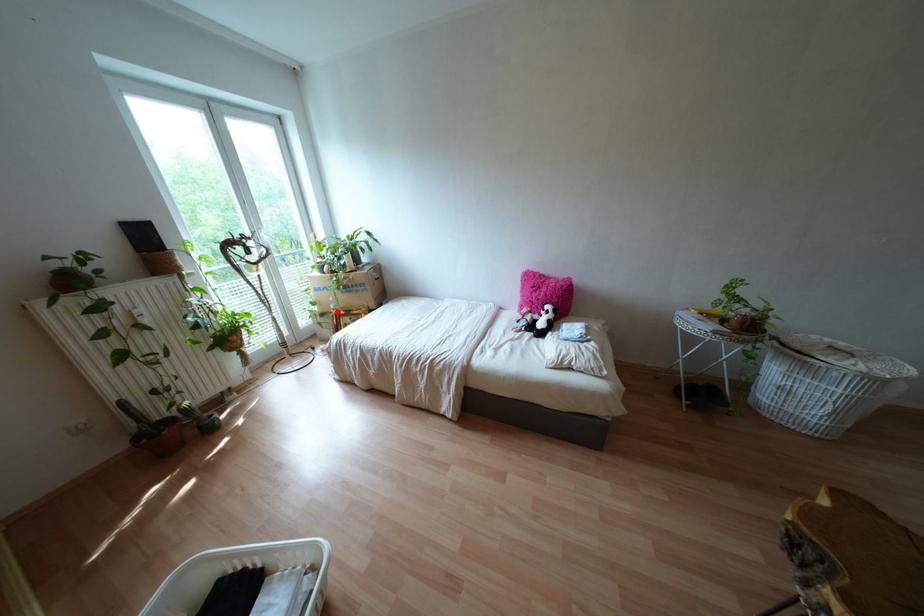
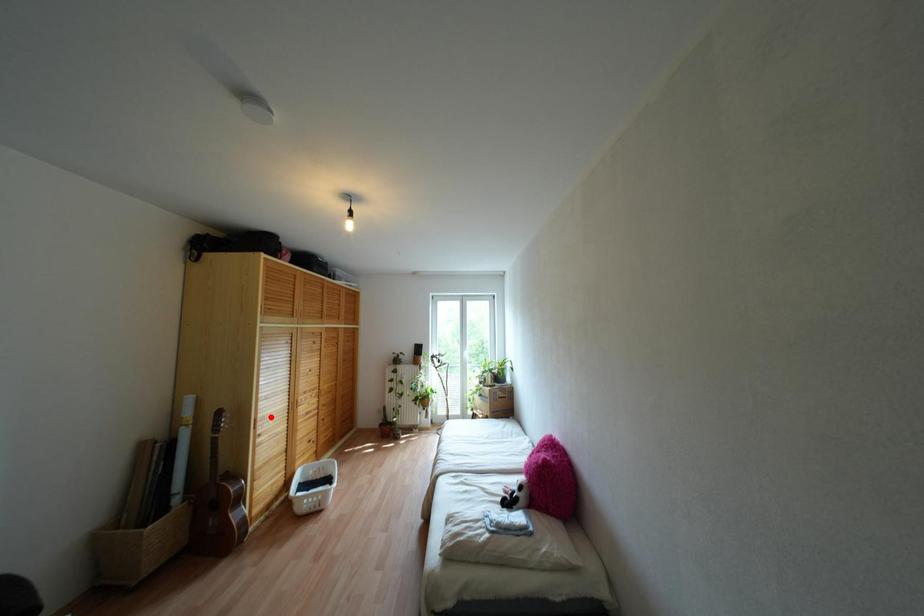
Consider the image. I am providing you with two images of the same scene from different viewpoints. A red point is marked on the first image and another point is marked on the second image. Is the marked point in image1 the same physical position as the marked point in image2?

No